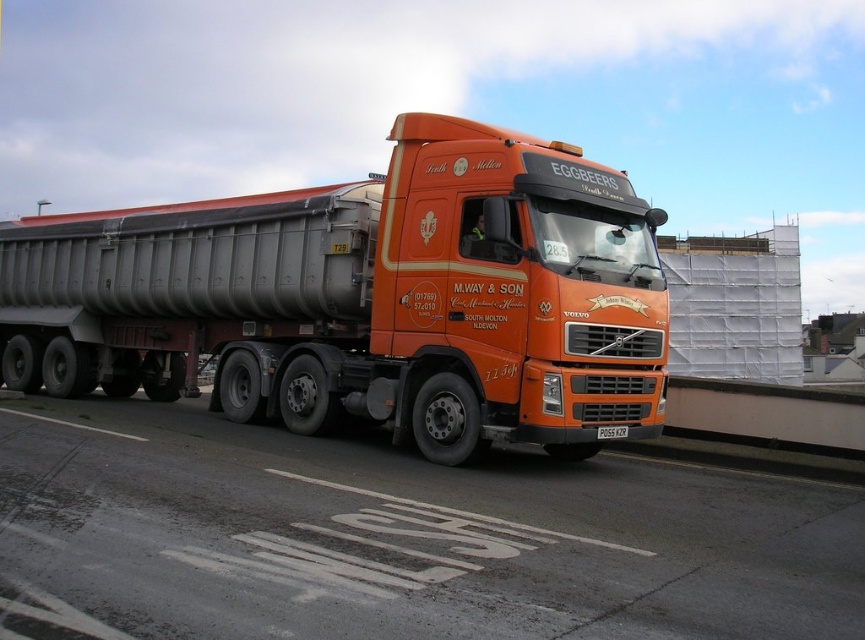
Who is more distant from viewer, (646, 525) or (587, 164)?

The point (587, 164) is more distant.

Is orange metallic truck at center in front of orange matte truck at center?

Yes.

The image size is (865, 640). In order to click on orange metallic truck at center in this screenshot , I will do `click(396, 538)`.

Does orange metallic truck at center appear under black plastic license plate at center?

Yes.

This screenshot has height=640, width=865. Describe the element at coordinates (396, 538) in the screenshot. I see `orange metallic truck at center` at that location.

In order to click on orange metallic truck at center in this screenshot , I will do `click(396, 538)`.

This screenshot has width=865, height=640. Find the location of `orange matte truck at center`. orange matte truck at center is located at coordinates (367, 298).

Is point (533, 273) positioned in front of point (603, 428)?

That is True.

Identify the location of orange matte truck at center. The image size is (865, 640). (367, 298).